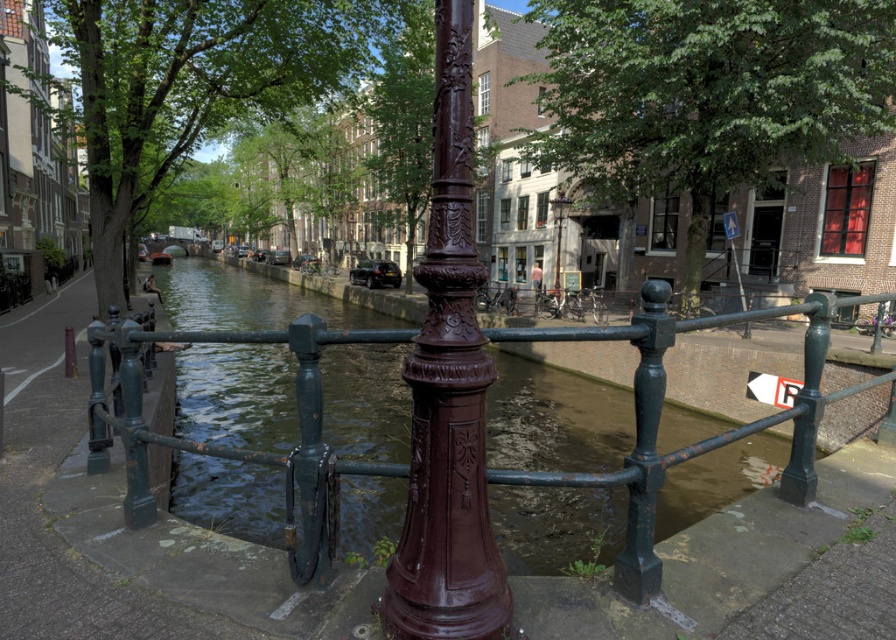
Question: Is green matte fence at center closer to camera compared to polished bronze lamp post at center?

Choices:
 (A) yes
 (B) no

Answer: (A)

Question: Among these points, which one is nearest to the camera?

Choices:
 (A) (560, 262)
 (B) (737, 228)

Answer: (B)

Question: Considering the real-world distances, which object is closest to the polished bronze lamp post at center?

Choices:
 (A) green matte fence at center
 (B) glossy burgundy post at center

Answer: (A)

Question: Is the position of polished bronze lamp post at center less distant than that of metallic blue sign at upper right?

Choices:
 (A) no
 (B) yes

Answer: (A)

Question: Which object is positioned farthest from the green matte fence at center?

Choices:
 (A) glossy burgundy post at center
 (B) polished bronze lamp post at center
 (C) metallic blue sign at upper right

Answer: (B)

Question: Does glossy burgundy post at center have a larger size compared to polished bronze lamp post at center?

Choices:
 (A) no
 (B) yes

Answer: (A)